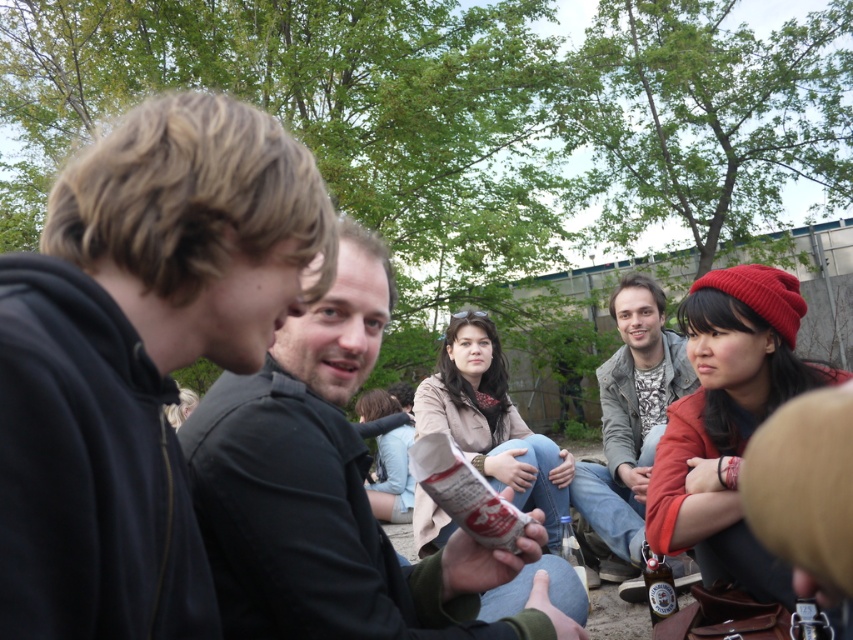
Question: Is dark gray shirt at center smaller than metallic silver can at lower right?

Choices:
 (A) no
 (B) yes

Answer: (A)

Question: Can you confirm if black matte jacket at left is thinner than dark gray shirt at center?

Choices:
 (A) no
 (B) yes

Answer: (B)

Question: Which object appears closest to the camera in this image?

Choices:
 (A) metallic silver can at lower right
 (B) dark gray shirt at center
 (C) black matte jacket at left
 (D) gray textured jacket at center

Answer: (C)

Question: Which of the following is the closest to the observer?

Choices:
 (A) (631, 554)
 (B) (318, 353)

Answer: (B)

Question: Does black matte jacket at left appear under dark gray shirt at center?

Choices:
 (A) yes
 (B) no

Answer: (B)

Question: Which object is positioned closest to the black matte jacket at left?

Choices:
 (A) gray textured jacket at center
 (B) dark gray shirt at center
 (C) metallic silver can at lower right

Answer: (B)